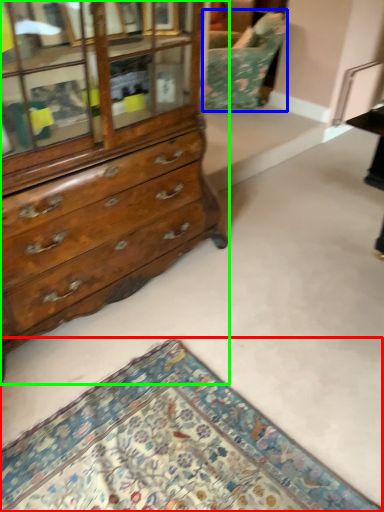
Question: Which object is positioned farthest from mat (highlighted by a red box)? Select from swivel chair (highlighted by a blue box) and chest of drawers (highlighted by a green box).

Choices:
 (A) swivel chair
 (B) chest of drawers

Answer: (A)